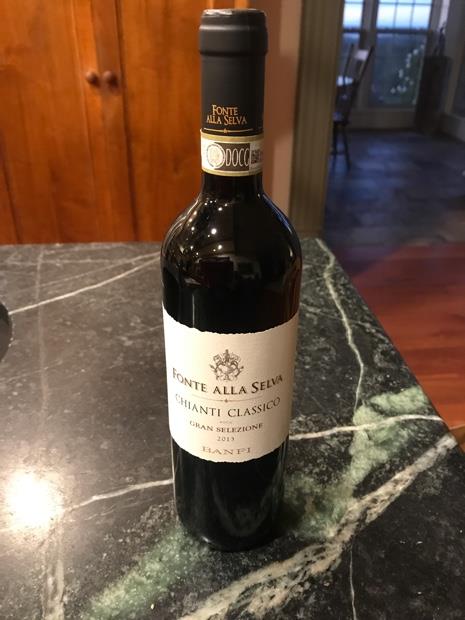
This screenshot has height=620, width=465. What are the coordinates of `wooden floor` in the screenshot? It's located at (397, 286), (449, 388).